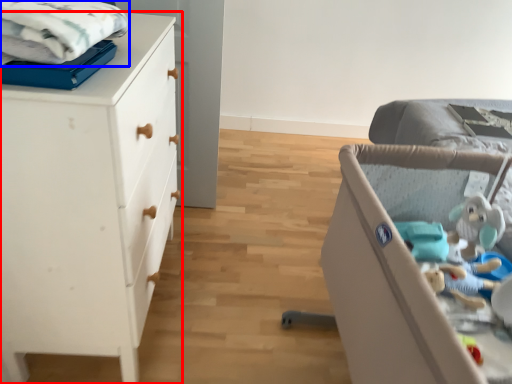
Question: Which object appears closest to the camera in this image, chest of drawers (highlighted by a red box) or cloth (highlighted by a blue box)?

Choices:
 (A) chest of drawers
 (B) cloth

Answer: (B)